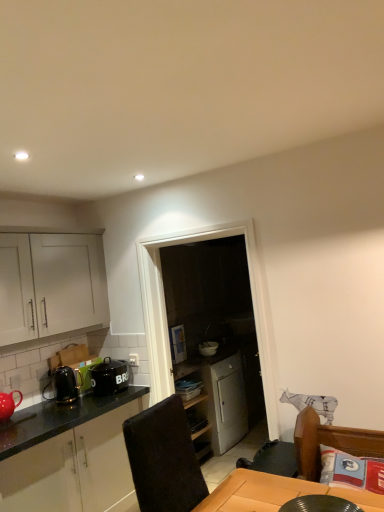
Question: From a real-world perspective, relative to shiny black kettle at left, which appears as the third appliance when viewed from the right, is black ceramic pot at left vertically above or below?

Choices:
 (A) above
 (B) below

Answer: (B)

Question: Would you say black ceramic pot at left is to the left or to the right of shiny black kettle at left, placed as the 2th appliance when sorted from back to front, in the picture?

Choices:
 (A) right
 (B) left

Answer: (A)

Question: Which is nearer to the black glossy plate at lower center, which ranks as the 1th appliance in front-to-back order?

Choices:
 (A) matte red teapot at lower left
 (B) black ceramic pot at left
 (C) brown leather swivel chair at lower right
 (D) white glossy bowl at center, acting as the second appliance starting from the right
 (E) white glossy cabinet at left, the 3th cabinetry from the top

Answer: (C)

Question: Considering the real-world distances, which object is closest to the matte red teapot at lower left?

Choices:
 (A) brown leather swivel chair at lower right
 (B) satin white cabinet at center, the 2th cabinetry when ordered from bottom to top
 (C) white glossy cabinet at left, which is the 1th cabinetry from bottom to top
 (D) white matte cabinet at left, the third cabinetry positioned from the bottom
 (E) shiny black kettle at left, which appears as the third appliance when viewed from the right

Answer: (E)